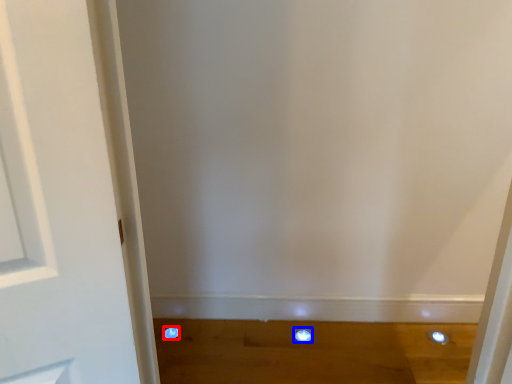
Question: Which object appears farthest to the camera in this image, dot (highlighted by a red box) or dot (highlighted by a blue box)?

Choices:
 (A) dot
 (B) dot

Answer: (A)